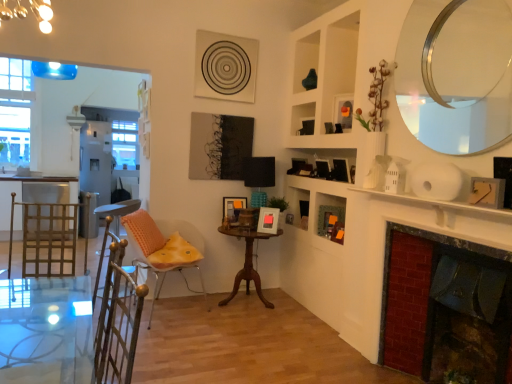
Question: Is brick fireplace at right turned away from orange matte picture frame at upper center, the 1th picture frame positioned from the top?

Choices:
 (A) yes
 (B) no

Answer: (B)

Question: Is brick fireplace at right oriented towards orange matte picture frame at upper center, acting as the fourth picture frame starting from the bottom?

Choices:
 (A) yes
 (B) no

Answer: (B)

Question: Does brick fireplace at right appear on the left side of orange matte picture frame at upper center, which is the 2th picture frame in front-to-back order?

Choices:
 (A) no
 (B) yes

Answer: (A)

Question: Could orange matte picture frame at upper center, the 1th picture frame positioned from the top, be considered to be inside brick fireplace at right?

Choices:
 (A) no
 (B) yes

Answer: (A)

Question: From a real-world perspective, is brick fireplace at right physically below orange matte picture frame at upper center, which is the 2th picture frame in front-to-back order?

Choices:
 (A) yes
 (B) no

Answer: (A)

Question: Is mahogany wood table at center situated inside orange matte picture frame at upper center, acting as the fourth picture frame starting from the bottom, or outside?

Choices:
 (A) inside
 (B) outside

Answer: (B)

Question: From the image's perspective, is mahogany wood table at center located above or below orange matte picture frame at upper center, placed as the 2th picture frame when sorted from right to left?

Choices:
 (A) below
 (B) above

Answer: (A)

Question: Considering the positions of mahogany wood table at center and orange matte picture frame at upper center, which is the 2th picture frame in front-to-back order, in the image, is mahogany wood table at center taller or shorter than orange matte picture frame at upper center, which is the 2th picture frame in front-to-back order,?

Choices:
 (A) short
 (B) tall

Answer: (B)

Question: From a real-world perspective, is mahogany wood table at center above or below orange matte picture frame at upper center, the 1th picture frame positioned from the top?

Choices:
 (A) above
 (B) below

Answer: (B)

Question: Is white glossy screen door at left to the left or to the right of clear glass window at upper left in the image?

Choices:
 (A) left
 (B) right

Answer: (B)

Question: Do you think white glossy screen door at left is within clear glass window at upper left, or outside of it?

Choices:
 (A) inside
 (B) outside

Answer: (B)

Question: In terms of size, does white glossy screen door at left appear bigger or smaller than clear glass window at upper left?

Choices:
 (A) big
 (B) small

Answer: (A)

Question: In terms of height, does white glossy screen door at left look taller or shorter compared to clear glass window at upper left?

Choices:
 (A) short
 (B) tall

Answer: (A)

Question: In terms of width, does orange fabric chair at center look wider or thinner when compared to wooden picture frame at upper right, placed as the fourth picture frame when sorted from left to right?

Choices:
 (A) wide
 (B) thin

Answer: (A)

Question: Is orange fabric chair at center situated inside wooden picture frame at upper right, marked as the 2th picture frame in a top-to-bottom arrangement, or outside?

Choices:
 (A) outside
 (B) inside

Answer: (A)